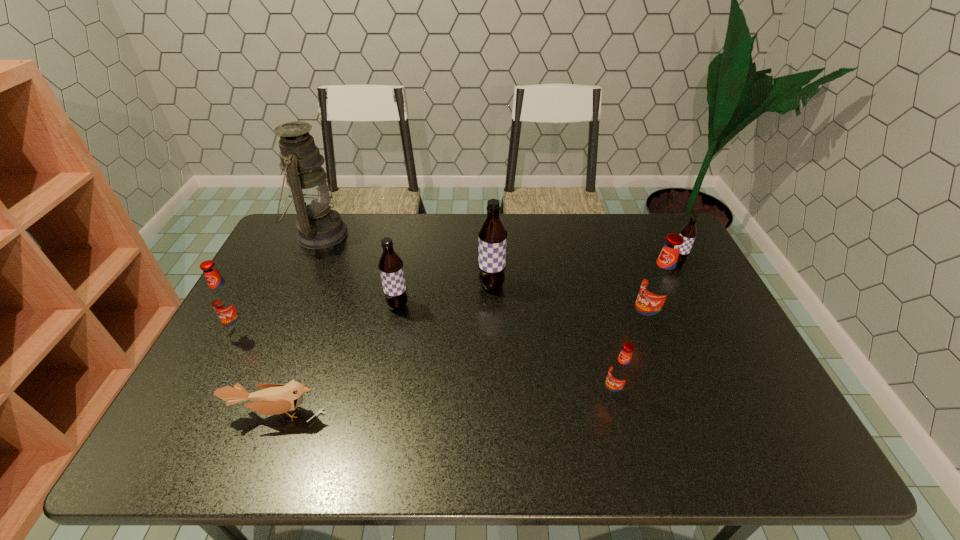
Locate an element on the screen. vacant area between the bird and the leftmost root beer is located at coordinates (259, 372).

Locate an element on the screen. This screenshot has height=540, width=960. free space between the leftmost root beer and the second red root beer from right to left is located at coordinates (427, 362).

What are the coordinates of `vacant space that's between the tallest object and the leftmost brown root beer` in the screenshot? It's located at (359, 270).

In order to click on vacant space that's between the leftmost root beer and the rightmost red root beer in this screenshot , I will do `click(444, 326)`.

Image resolution: width=960 pixels, height=540 pixels. In order to click on the seventh closest object to the fifth root beer from left to right in this screenshot , I will do `click(225, 300)`.

At what (x,y) coordinates should I click in order to perform the action: click on object that ranks as the closest to the rightmost object. Please return your answer as a coordinate pair (x, y). This screenshot has height=540, width=960. Looking at the image, I should click on (659, 283).

Choose which root beer is the third nearest neighbor to the leftmost red root beer. Please provide its 2D coordinates. Your answer should be formatted as a tuple, i.e. [(x, y)], where the tuple contains the x and y coordinates of a point satisfying the conditions above.

[(620, 371)]

You are a GUI agent. You are given a task and a screenshot of the screen. Output one action in this format:
    pyautogui.click(x=<x>, y=<y>)
    Task: Click on the root beer that is the second closest to the biggest red root beer
    
    Given the screenshot: What is the action you would take?
    pyautogui.click(x=688, y=232)

At what (x,y) coordinates should I click in order to perform the action: click on the third closest brown root beer to the tallest object. Please return your answer as a coordinate pair (x, y). Looking at the image, I should click on (688, 232).

Select which brown root beer appears as the third closest to the fourth root beer from left to right. Please provide its 2D coordinates. Your answer should be formatted as a tuple, i.e. [(x, y)], where the tuple contains the x and y coordinates of a point satisfying the conditions above.

[(390, 265)]